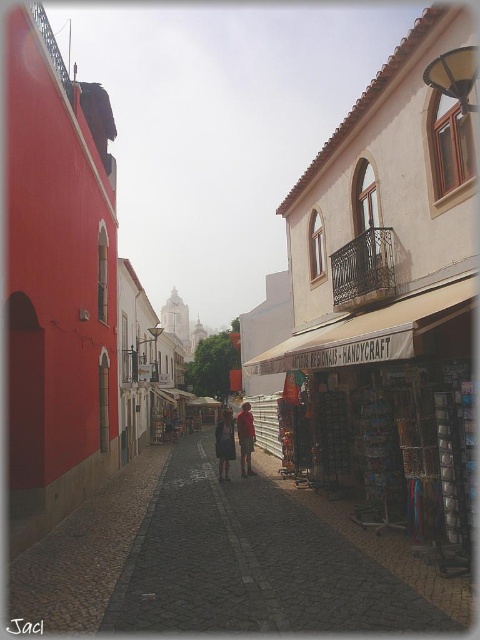
How much distance is there between reddish-brown leather shoes at center and dark brown leather jacket at center?

A distance of 13.39 inches exists between reddish-brown leather shoes at center and dark brown leather jacket at center.

Between point (240, 426) and point (231, 420), which one is positioned in front?

Point (231, 420) is more forward.

Is point (245, 436) more distant than point (225, 456)?

Yes, point (245, 436) is farther from viewer.

This screenshot has height=640, width=480. I want to click on reddish-brown leather shoes at center, so click(x=225, y=444).

In the scene shown: Is dark cobblestone alley at center shorter than reddish-brown leather shoes at center?

Indeed, dark cobblestone alley at center has a lesser height compared to reddish-brown leather shoes at center.

Is the position of dark cobblestone alley at center more distant than that of reddish-brown leather shoes at center?

That is False.

Identify the location of dark cobblestone alley at center. (224, 560).

Which is in front, point (249, 458) or point (241, 412)?

Point (249, 458) is in front.

What do you see at coordinates (225, 444) in the screenshot? This screenshot has height=640, width=480. I see `reddish-brown leather shoes at center` at bounding box center [225, 444].

Is point (244, 410) positioned before point (244, 464)?

That is False.

Locate an element on the screen. reddish-brown leather shoes at center is located at coordinates (225, 444).